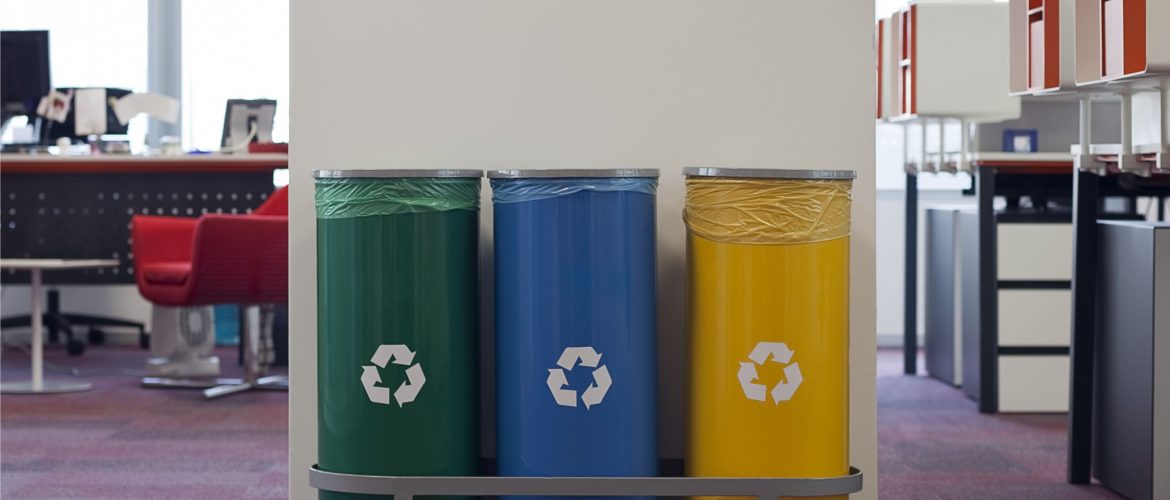
What are the coordinates of `red chair` in the screenshot? It's located at (220, 262).